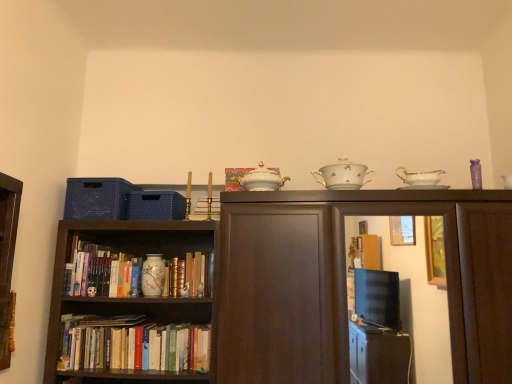
Question: Is the surface of white porcelain sugar bowl at upper center, the second tableware from the back, in direct contact with porcelain bowl at upper center, which is the first book from front to back?

Choices:
 (A) yes
 (B) no

Answer: (B)

Question: Is white porcelain sugar bowl at upper center, marked as the second tableware in a bottom-to-top arrangement, closer to camera compared to porcelain bowl at upper center, acting as the third book starting from the left?

Choices:
 (A) yes
 (B) no

Answer: (A)

Question: Is white porcelain sugar bowl at upper center, acting as the 1th tableware starting from the front, oriented away from porcelain bowl at upper center, which is the first book from right to left?

Choices:
 (A) no
 (B) yes

Answer: (A)

Question: From a real-world perspective, is white porcelain sugar bowl at upper center, which ranks as the second tableware in left-to-right order, located higher than porcelain bowl at upper center, which is the first book from front to back?

Choices:
 (A) no
 (B) yes

Answer: (A)

Question: Is white porcelain sugar bowl at upper center, which is the 1th tableware from right to left, further to camera compared to porcelain bowl at upper center, acting as the third book starting from the left?

Choices:
 (A) no
 (B) yes

Answer: (A)

Question: Is porcelain bowl at upper center, which is the first book from right to left, inside white porcelain sugar bowl at upper center, marked as the second tableware in a bottom-to-top arrangement?

Choices:
 (A) no
 (B) yes

Answer: (A)

Question: Is porcelain bowl at upper center, which ranks as the third book in back-to-front order, positioned behind white porcelain sugar bowl at upper center, which is the 1th tableware from right to left?

Choices:
 (A) no
 (B) yes

Answer: (B)

Question: Can you confirm if porcelain bowl at upper center, which is the first book from front to back, is shorter than white porcelain sugar bowl at upper center, marked as the second tableware in a bottom-to-top arrangement?

Choices:
 (A) yes
 (B) no

Answer: (A)

Question: Can you confirm if porcelain bowl at upper center, placed as the 3th book when sorted from bottom to top, is taller than white porcelain sugar bowl at upper center, marked as the second tableware in a bottom-to-top arrangement?

Choices:
 (A) yes
 (B) no

Answer: (B)

Question: Is the position of porcelain bowl at upper center, placed as the 3th book when sorted from bottom to top, less distant than that of white porcelain sugar bowl at upper center, marked as the second tableware in a bottom-to-top arrangement?

Choices:
 (A) no
 (B) yes

Answer: (A)

Question: Is porcelain bowl at upper center, which is the first book from front to back, not within white porcelain sugar bowl at upper center, acting as the 1th tableware starting from the front?

Choices:
 (A) no
 (B) yes

Answer: (B)

Question: From a real-world perspective, is porcelain bowl at upper center, which appears as the 1th book when viewed from the top, positioned over white porcelain sugar bowl at upper center, acting as the 1th tableware starting from the front, based on gravity?

Choices:
 (A) no
 (B) yes

Answer: (B)

Question: Does matte ceramic book at center, arranged as the 2th book when viewed from the top, have a smaller size compared to white porcelain sugar bowl at upper center, acting as the 1th tableware starting from the front?

Choices:
 (A) no
 (B) yes

Answer: (B)